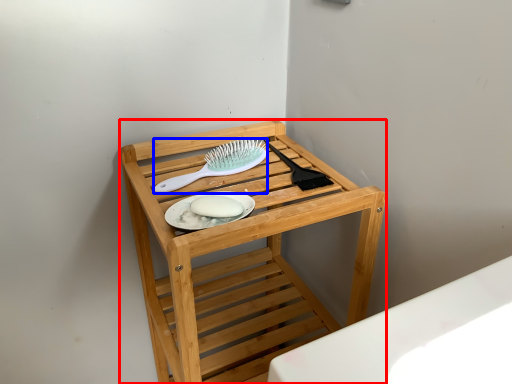
Question: Among these objects, which one is nearest to the camera, furniture (highlighted by a red box) or brush (highlighted by a blue box)?

Choices:
 (A) furniture
 (B) brush

Answer: (A)